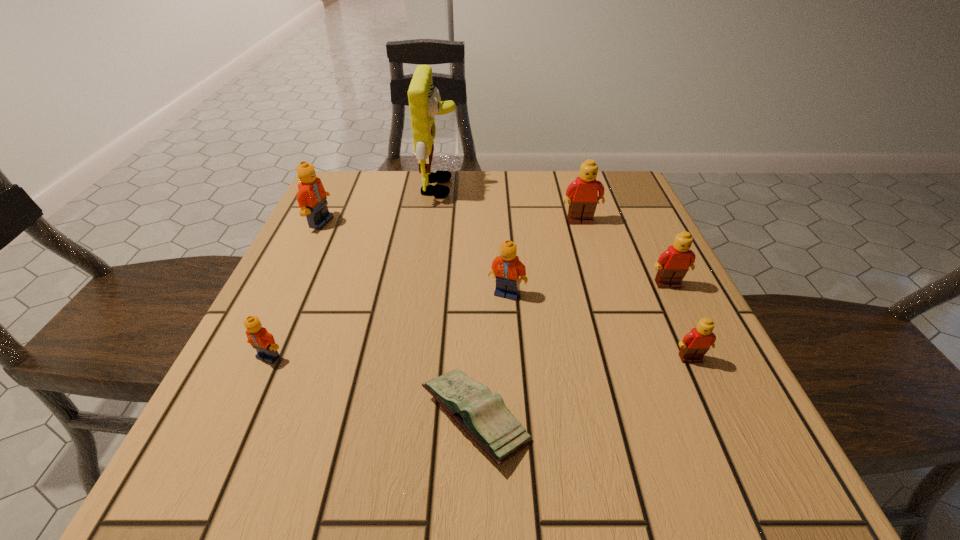
What are the coordinates of `the farthest object` in the screenshot? It's located at (425, 102).

You are a GUI agent. You are given a task and a screenshot of the screen. Output one action in this format:
    pyautogui.click(x=<x>, y=<y>)
    Task: Click on the sponge
    This screenshot has height=540, width=960.
    Given the screenshot: What is the action you would take?
    pyautogui.click(x=425, y=102)

Find the location of a particular element. the biggest orange Lego is located at coordinates (311, 197).

You are a GUI agent. You are given a task and a screenshot of the screen. Output one action in this format:
    pyautogui.click(x=<x>, y=<y>)
    Task: Click on the farthest brown Lego
    This screenshot has height=540, width=960.
    Given the screenshot: What is the action you would take?
    pyautogui.click(x=582, y=193)

You are a GUI agent. You are given a task and a screenshot of the screen. Output one action in this format:
    pyautogui.click(x=<x>, y=<y>)
    Task: Click on the biggest brown Lego
    The image size is (960, 540).
    Given the screenshot: What is the action you would take?
    pyautogui.click(x=582, y=193)

Locate an element on the screen. Image resolution: width=960 pixels, height=540 pixels. the rightmost orange Lego is located at coordinates (507, 267).

Identify the location of the second nearest orange Lego. (507, 267).

Find the location of a particular element. Image resolution: width=960 pixels, height=540 pixels. the second farthest brown Lego is located at coordinates (673, 264).

Where is `the nearest orange Lego`? the nearest orange Lego is located at coordinates (258, 336).

What are the coordinates of `the smallest brown Lego` in the screenshot? It's located at (695, 344).